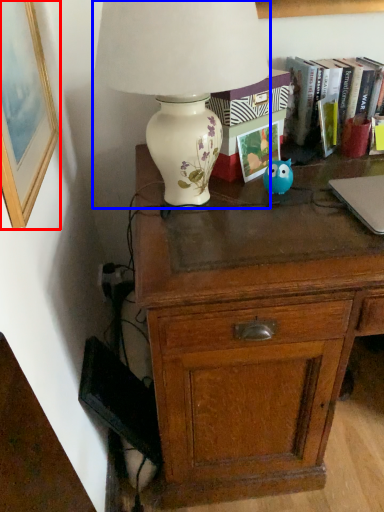
Question: Among these objects, which one is farthest to the camera, picture frame (highlighted by a red box) or lamp (highlighted by a blue box)?

Choices:
 (A) picture frame
 (B) lamp

Answer: (B)